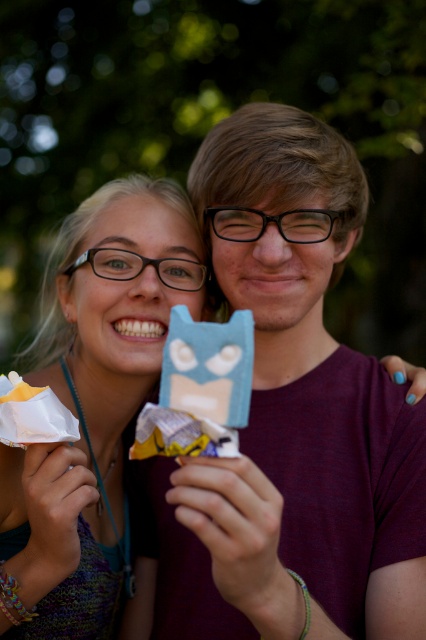
Is matte blue ice cream at center wider than blue matte ice cream bar at center?

Indeed, matte blue ice cream at center has a greater width compared to blue matte ice cream bar at center.

Which is behind, point (8, 464) or point (239, 394)?

The point (8, 464) is behind.

Where is `matte blue ice cream at center`? Image resolution: width=426 pixels, height=640 pixels. matte blue ice cream at center is located at coordinates (92, 404).

Is point (155, 406) in front of point (60, 408)?

Yes.

Find the location of a particular element. This screenshot has height=640, width=426. blue matte ice cream bar at center is located at coordinates (199, 388).

The height and width of the screenshot is (640, 426). I want to click on matte blue ice cream at center, so click(92, 404).

Is matte blue ice cream at center shorter than white paper wrapper at lower left?

In fact, matte blue ice cream at center may be taller than white paper wrapper at lower left.

Is point (85, 506) closer to camera compared to point (17, 442)?

Yes, it is.

Find the location of a particular element. The height and width of the screenshot is (640, 426). matte blue ice cream at center is located at coordinates (92, 404).